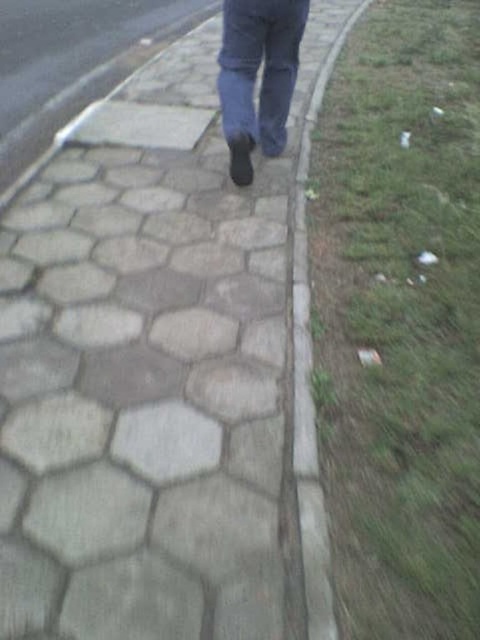
You are a delivery person trying to place a package on the gray concrete curb at center next to the denim at center. Can you fit the package between them?

The gray concrete curb at center is much taller than the denim at center, so there is sufficient vertical space to place the package between them.

You are standing on the pathway and want to reach the curb that separates the pathway from the grassy area. The curb is located at point (312, 472). If you can walk 1.8 meters in one minute, how long will it take you to reach the curb?

The distance between you and the curb at point (312, 472) is 1.81 meters. Since you can walk 1.8 meters per minute, it will take approximately 1 minute to reach the curb.

You are a delivery person trying to navigate the pathway. You see the gray concrete curb at center and the denim at center. Which one is smaller in size?

The gray concrete curb at center is smaller than denim at center.